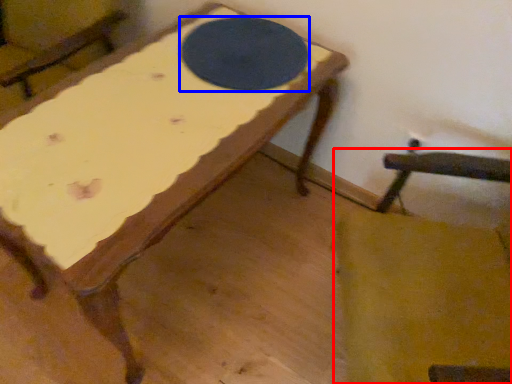
Question: Which of the following is the closest to the observer, rocking chair (highlighted by a red box) or table tennis table (highlighted by a blue box)?

Choices:
 (A) rocking chair
 (B) table tennis table

Answer: (A)